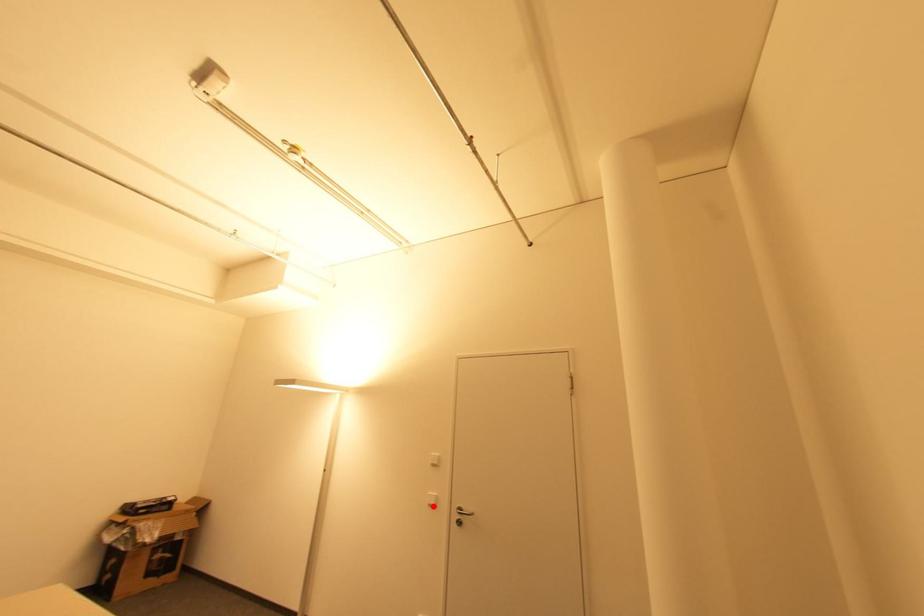
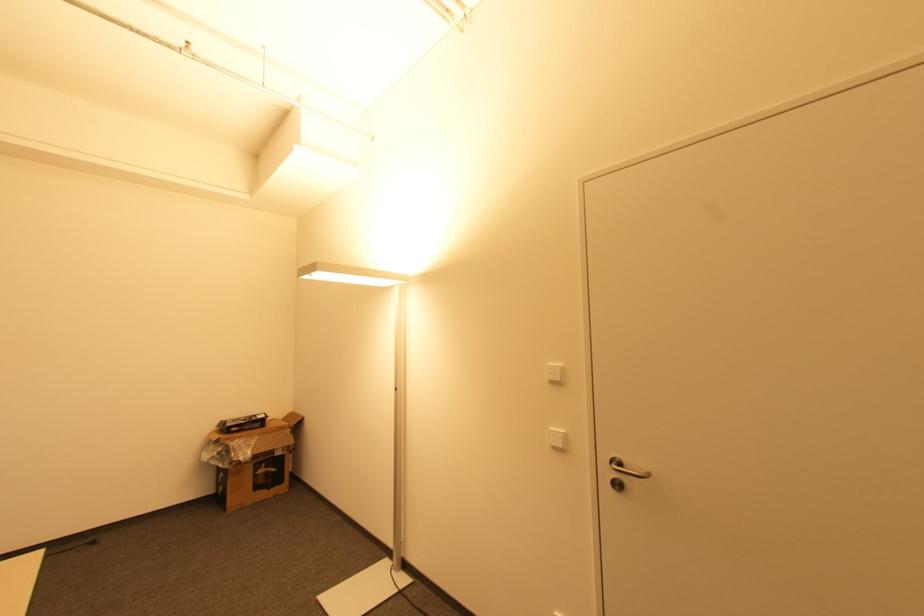
Question: I am providing you with two images of the same scene from different viewpoints. A red point is marked on the first image. Is the red point's position out of view in image 2?

Choices:
 (A) Yes
 (B) No

Answer: (B)